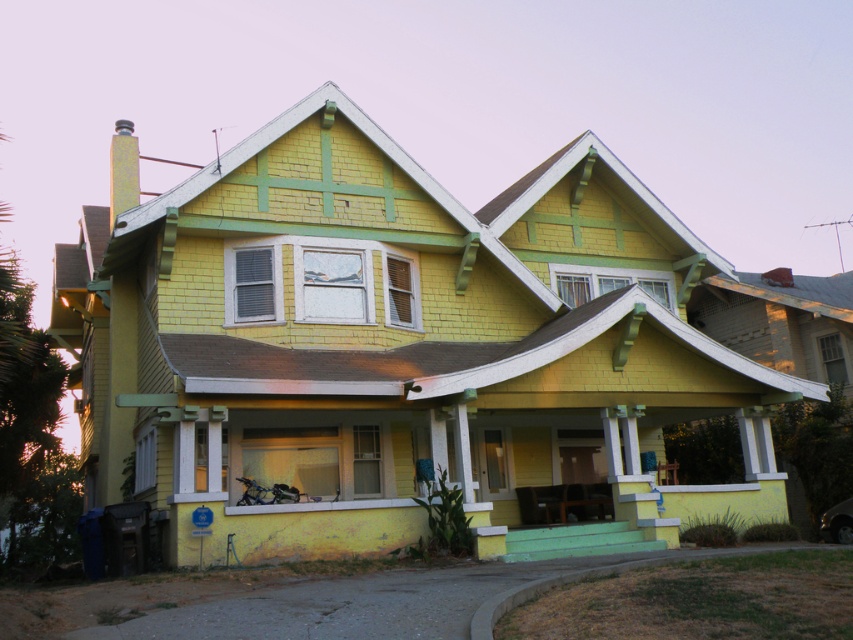
Question: Can you confirm if yellow shingles at center is positioned to the right of yellow painted wood porch at lower center?

Choices:
 (A) no
 (B) yes

Answer: (A)

Question: Which point is farther to the camera?

Choices:
 (A) yellow painted wood porch at lower center
 (B) yellow shingles at center

Answer: (B)

Question: Which object is closer to the camera taking this photo?

Choices:
 (A) yellow shingles at center
 (B) yellow painted wood porch at lower center

Answer: (B)

Question: Considering the relative positions of yellow shingles at center and yellow painted wood porch at lower center in the image provided, where is yellow shingles at center located with respect to yellow painted wood porch at lower center?

Choices:
 (A) below
 (B) above

Answer: (B)

Question: Does yellow shingles at center appear over yellow painted wood porch at lower center?

Choices:
 (A) no
 (B) yes

Answer: (B)